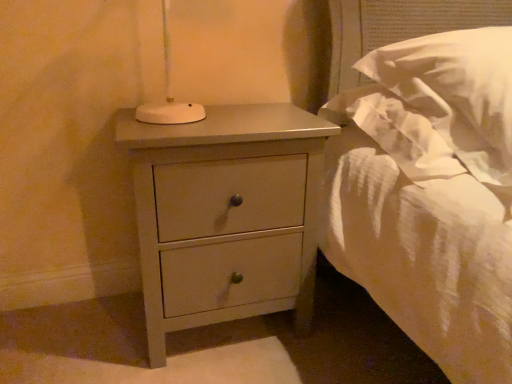
Question: Is white soft pillow at upper right far from matte gray nightstand at lower left?

Choices:
 (A) yes
 (B) no

Answer: (B)

Question: Is white soft pillow at upper right at the right side of matte gray nightstand at lower left?

Choices:
 (A) yes
 (B) no

Answer: (A)

Question: Is white soft pillow at upper right positioned with its back to matte gray nightstand at lower left?

Choices:
 (A) no
 (B) yes

Answer: (A)

Question: From the image's perspective, is white soft pillow at upper right located above matte gray nightstand at lower left?

Choices:
 (A) no
 (B) yes

Answer: (B)

Question: From a real-world perspective, is white soft pillow at upper right physically above matte gray nightstand at lower left?

Choices:
 (A) yes
 (B) no

Answer: (A)

Question: Is white soft pillow at upper right facing towards matte gray nightstand at lower left?

Choices:
 (A) no
 (B) yes

Answer: (A)

Question: Is matte gray nightstand at lower left located outside white soft pillow at upper right?

Choices:
 (A) no
 (B) yes

Answer: (B)

Question: Does matte gray nightstand at lower left lie behind white soft pillow at upper right?

Choices:
 (A) yes
 (B) no

Answer: (A)

Question: Considering the relative sizes of matte gray nightstand at lower left and white soft pillow at upper right in the image provided, is matte gray nightstand at lower left shorter than white soft pillow at upper right?

Choices:
 (A) yes
 (B) no

Answer: (B)

Question: From a real-world perspective, is matte gray nightstand at lower left below white soft pillow at upper right?

Choices:
 (A) yes
 (B) no

Answer: (A)

Question: From a real-world perspective, is matte gray nightstand at lower left on top of white soft pillow at upper right?

Choices:
 (A) no
 (B) yes

Answer: (A)

Question: Is matte gray nightstand at lower left turned away from white soft pillow at upper right?

Choices:
 (A) yes
 (B) no

Answer: (B)

Question: From a real-world perspective, relative to matte gray nightstand at lower left, is white soft pillow at upper right vertically above or below?

Choices:
 (A) above
 (B) below

Answer: (A)